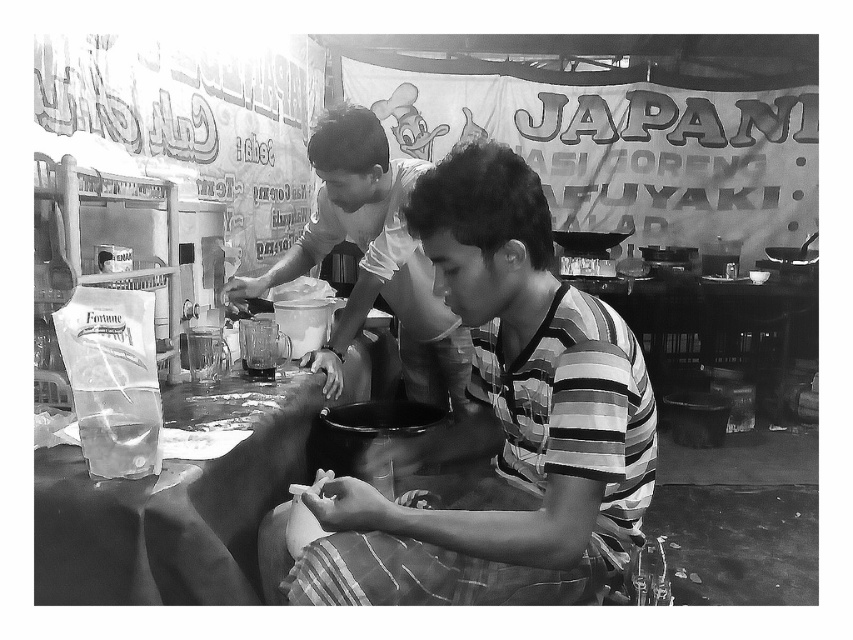
Between point (498, 316) and point (311, 352), which one is positioned behind?

Positioned behind is point (311, 352).

Identify the location of striped fabric shirt at center. (500, 420).

This screenshot has width=853, height=640. Describe the element at coordinates (500, 420) in the screenshot. I see `striped fabric shirt at center` at that location.

Find the location of a particular element. striped fabric shirt at center is located at coordinates (500, 420).